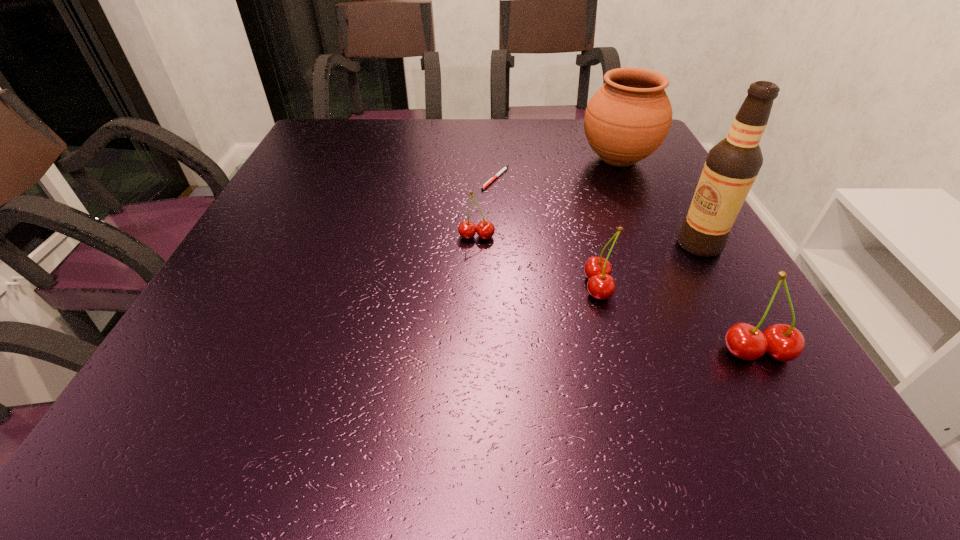
Locate an element on the screen. The width and height of the screenshot is (960, 540). vacant space at the near left corner of the desktop is located at coordinates click(187, 345).

Locate an element on the screen. free point between the tallest object and the third tallest object is located at coordinates (728, 298).

Where is `unoccupied area between the nearest cherry and the alcohol`? The image size is (960, 540). unoccupied area between the nearest cherry and the alcohol is located at coordinates (728, 298).

Where is `vacant point located between the second cherry from left to right and the pen`? vacant point located between the second cherry from left to right and the pen is located at coordinates (547, 232).

In order to click on vacant space that's between the alcohol and the fifth shortest object in this screenshot , I will do `click(659, 202)`.

Find the location of a particular element. This screenshot has width=960, height=540. free space between the alcohol and the leftmost cherry is located at coordinates (588, 240).

Locate an element on the screen. free space that is in between the shortest object and the tallest object is located at coordinates (597, 211).

Where is `vacant area that lies between the second nearest object and the leftmost cherry`? vacant area that lies between the second nearest object and the leftmost cherry is located at coordinates (538, 261).

You are a GUI agent. You are given a task and a screenshot of the screen. Output one action in this format:
    pyautogui.click(x=<x>, y=<y>)
    Task: Click on the vacant area between the second tallest cherry and the leftmost cherry
    The image size is (960, 540).
    Given the screenshot: What is the action you would take?
    pyautogui.click(x=538, y=261)

Find the location of a particular element. The height and width of the screenshot is (540, 960). free space between the fifth farthest object and the leftmost cherry is located at coordinates (538, 261).